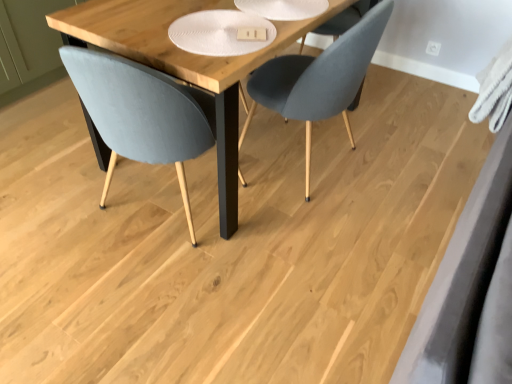
You are a GUI agent. You are given a task and a screenshot of the screen. Output one action in this format:
    pyautogui.click(x=<x>, y=<y>)
    Task: Click on the vacant location below velvet grey chair at center, the first chair in the right-to-left sequence (from a real-world perspective)
    This screenshot has width=512, height=384.
    Given the screenshot: What is the action you would take?
    pyautogui.click(x=323, y=173)